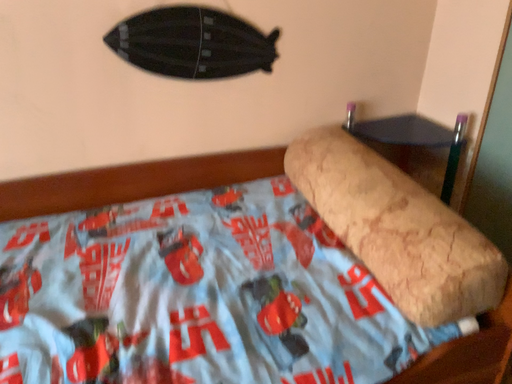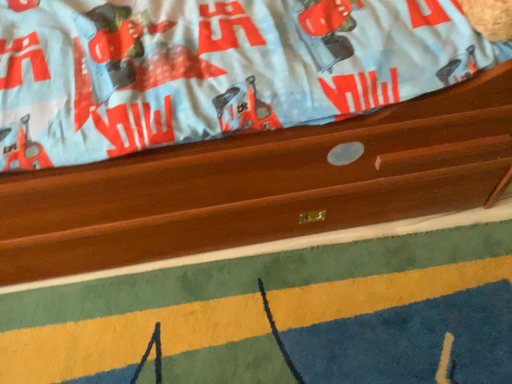
Question: How did the camera likely rotate when shooting the video?

Choices:
 (A) rotated upward
 (B) rotated downward

Answer: (B)